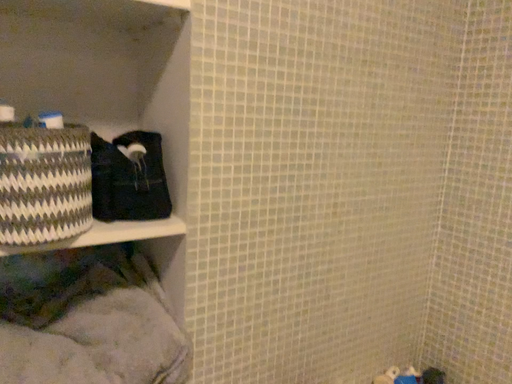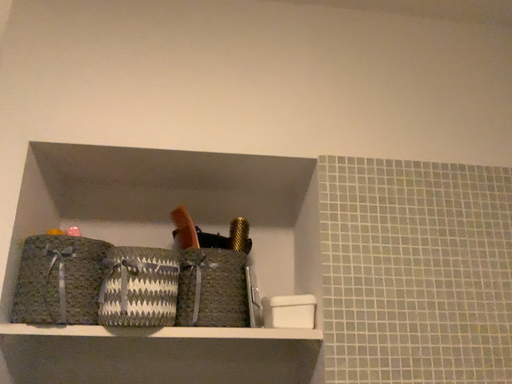
Question: Which way did the camera rotate in the video?

Choices:
 (A) rotated right
 (B) rotated left

Answer: (B)